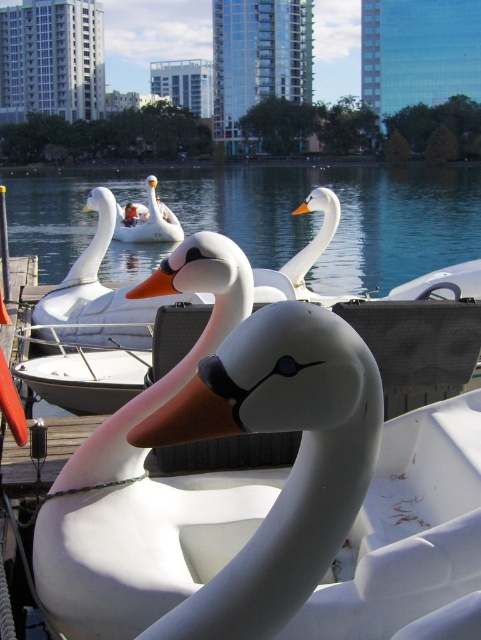
Question: Which object is the farthest from the orange matte beak at center?

Choices:
 (A) white glossy swan at upper center
 (B) clear blue water at center

Answer: (B)

Question: Among these objects, which one is farthest from the camera?

Choices:
 (A) white glossy swan at upper center
 (B) orange matte beak at center
 (C) clear blue water at center

Answer: (A)

Question: Among these objects, which one is farthest from the camera?

Choices:
 (A) orange matte beak at center
 (B) clear blue water at center
 (C) matte white swan at center
 (D) white glossy swan at upper center

Answer: (D)

Question: Is matte white swan at center closer to camera compared to white glossy swan at upper center?

Choices:
 (A) yes
 (B) no

Answer: (A)

Question: Does clear blue water at center have a smaller size compared to orange matte beak at center?

Choices:
 (A) no
 (B) yes

Answer: (A)

Question: Can you confirm if clear blue water at center is positioned to the right of white glossy swan at upper center?

Choices:
 (A) no
 (B) yes

Answer: (A)